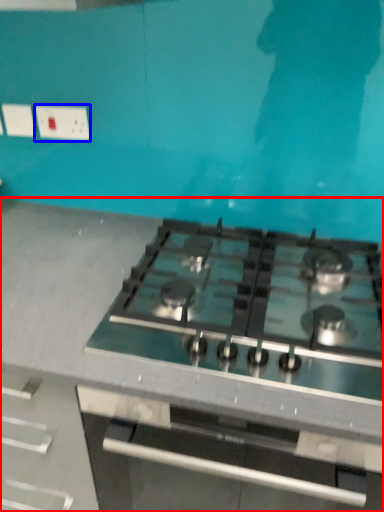
Question: Which object appears farthest to the camera in this image, countertop (highlighted by a red box) or electric outlet (highlighted by a blue box)?

Choices:
 (A) countertop
 (B) electric outlet

Answer: (B)